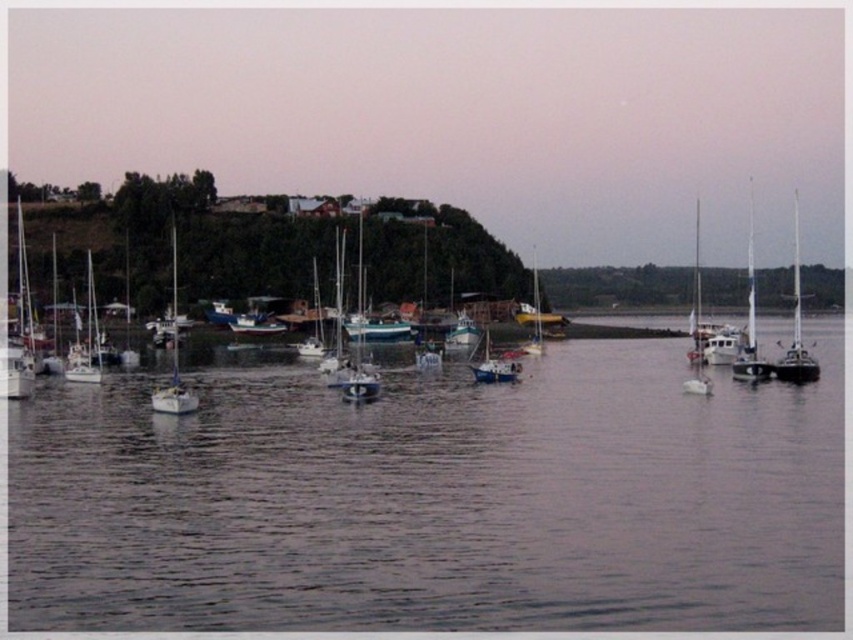
Looking at this image, is dark gray water at center below white matte sailboat at left?

Indeed, dark gray water at center is positioned under white matte sailboat at left.

Between point (154, 461) and point (91, 301), which one is positioned in front?

Positioned in front is point (154, 461).

Where is `dark gray water at center`? dark gray water at center is located at coordinates (436, 500).

Can you confirm if white matte sailboat at left is wider than white matte sailboat at center?

Yes, white matte sailboat at left is wider than white matte sailboat at center.

This screenshot has width=853, height=640. Find the location of `white matte sailboat at left`. white matte sailboat at left is located at coordinates (86, 339).

Is white matte sailboat at center positioned behind shiny blue sailboat at center?

No, it is in front of shiny blue sailboat at center.

Identify the location of white matte sailboat at center. (494, 368).

Locate an element on the screen. The image size is (853, 640). white matte sailboat at center is located at coordinates (494, 368).